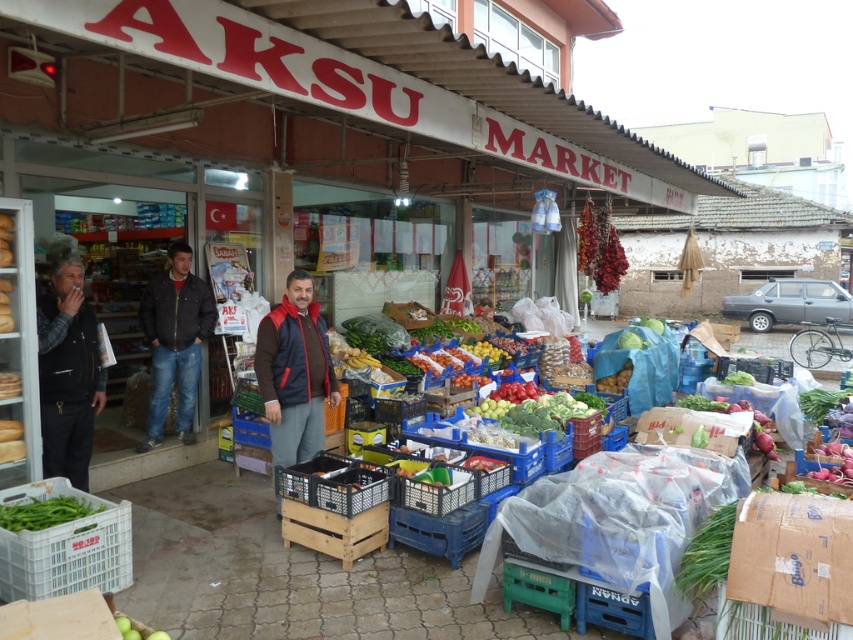
You are standing at the entrance of Aksu Market and want to take a photo of both the point at coordinates (181, 291) and the point at coordinates (16, 508). Which point should you focus on first to ensure both are in clear view?

You should focus on the point at coordinates (181, 291) first because it is closer to you than the point at coordinates (16, 508), ensuring both points are in clear view.